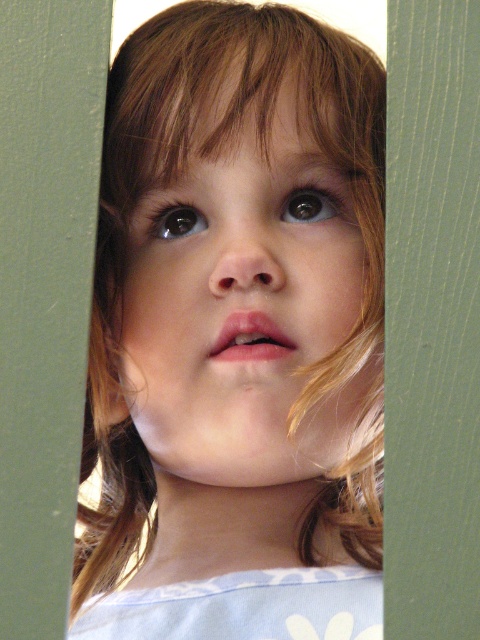
Question: Among these points, which one is nearest to the camera?

Choices:
 (A) (35, 579)
 (B) (274, 225)

Answer: (A)

Question: Considering the relative positions of smooth blonde hair at center and green matte door at center in the image provided, where is smooth blonde hair at center located with respect to green matte door at center?

Choices:
 (A) below
 (B) above

Answer: (B)

Question: Can you confirm if smooth blonde hair at center is positioned above green matte door at center?

Choices:
 (A) yes
 (B) no

Answer: (A)

Question: Considering the relative positions of smooth blonde hair at center and green matte door at center in the image provided, where is smooth blonde hair at center located with respect to green matte door at center?

Choices:
 (A) left
 (B) right

Answer: (B)